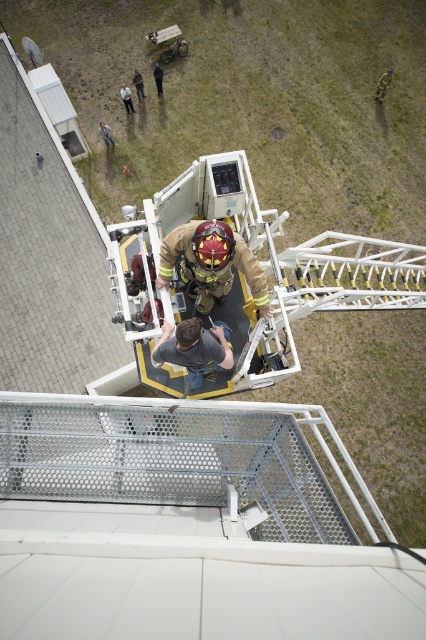
Does gray matte shirt at center appear over brown leather jacket at upper center?

Actually, gray matte shirt at center is below brown leather jacket at upper center.

How distant is gray matte shirt at center from brown leather jacket at upper center?

gray matte shirt at center and brown leather jacket at upper center are 46.18 feet apart from each other.

This screenshot has height=640, width=426. What do you see at coordinates (193, 348) in the screenshot? I see `gray matte shirt at center` at bounding box center [193, 348].

Identify the location of gray matte shirt at center. (193, 348).

Who is higher up, light brown leather jacket at upper center or brown leather jacket at upper center?

brown leather jacket at upper center

Is light brown leather jacket at upper center above brown leather jacket at upper center?

Actually, light brown leather jacket at upper center is below brown leather jacket at upper center.

Is point (126, 90) closer to viewer compared to point (138, 92)?

Yes, point (126, 90) is closer to viewer.

Locate an element on the screen. This screenshot has width=426, height=640. light brown leather jacket at upper center is located at coordinates (126, 99).

Between light brown leather jacket at upper center and dark brown leather jacket at upper center, which one appears on the right side from the viewer's perspective?

dark brown leather jacket at upper center is more to the right.

This screenshot has height=640, width=426. What do you see at coordinates (126, 99) in the screenshot?
I see `light brown leather jacket at upper center` at bounding box center [126, 99].

The image size is (426, 640). I want to click on light brown leather jacket at upper center, so pos(126,99).